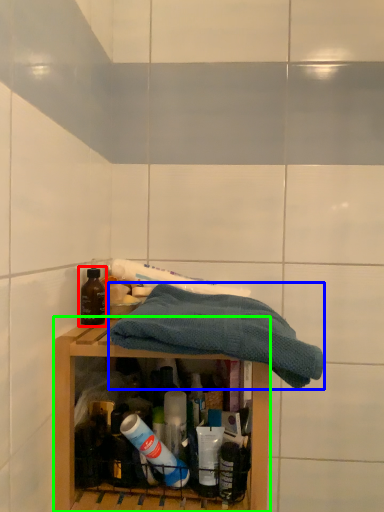
Question: Which object is the closest to the bottle (highlighted by a red box)? Choose among these: towel (highlighted by a blue box) or shelf (highlighted by a green box).

Choices:
 (A) towel
 (B) shelf

Answer: (B)